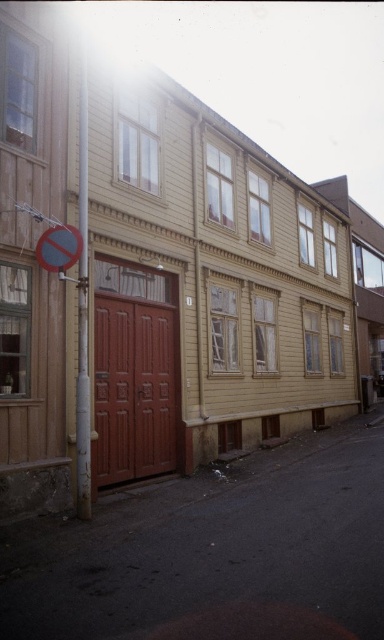
You are standing in front of the two story wooden building and want to hang a new banner between the metallic silver pole at center and the yellow plastic traffic sign at upper left. Which object should you attach the top of the banner to so it hangs properly?

You should attach the top of the banner to the metallic silver pole at center because it is taller than the yellow plastic traffic sign at upper left, ensuring the banner hangs properly between them.

In the scene shown: You are standing in front of the two story wooden building and want to determine if the brown wooden alley at lower left can be used to support the metallic silver pole at center. Can the alley support the pole based on their heights?

The brown wooden alley at lower left is shorter than the metallic silver pole at center, so it cannot support the pole as it is not tall enough.

You are standing in front of the two story wooden building and want to locate the brown wooden alley at lower left and the yellow plastic traffic sign at upper left. Which object is positioned higher from the ground?

The yellow plastic traffic sign at upper left is positioned higher from the ground than the brown wooden alley at lower left.